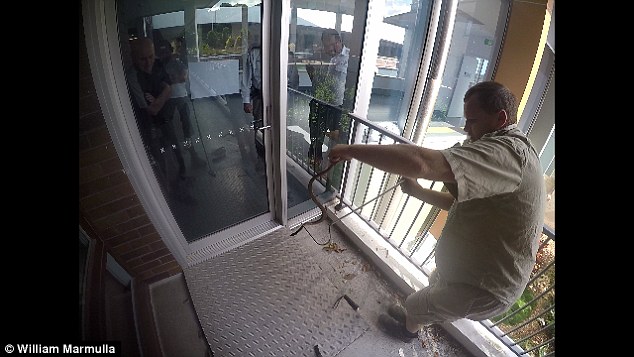
Find the location of a particular element. The width and height of the screenshot is (634, 357). brick wall is located at coordinates (124, 203).